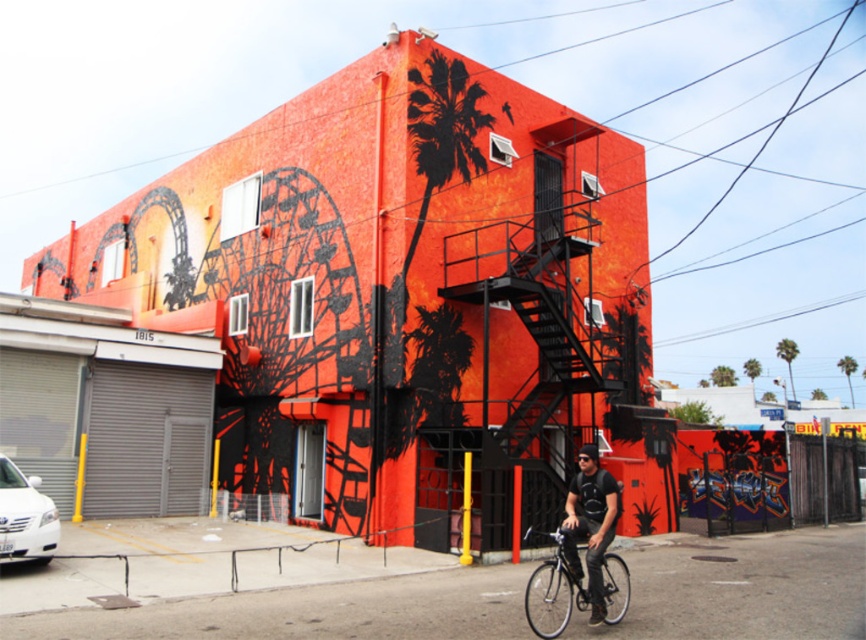
Between shiny silver bicycle at lower center and matte black bicycle at lower right, which one has more height?

Standing taller between the two is matte black bicycle at lower right.

Is shiny silver bicycle at lower center above matte black bicycle at lower right?

Incorrect, shiny silver bicycle at lower center is not positioned above matte black bicycle at lower right.

Measure the distance between shiny silver bicycle at lower center and camera.

shiny silver bicycle at lower center is 7.76 meters away from camera.

I want to click on shiny silver bicycle at lower center, so click(553, 589).